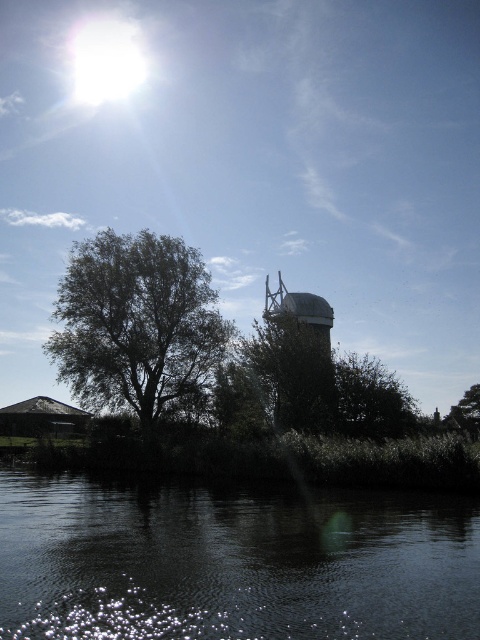
You are standing at the point with coordinates point (213, 298) and want to walk towards the point with coordinates point (457, 426). Based on the scene, will you pass through any obstacles along the way?

Since point (213, 298) is in front of point (457, 426), you will not pass through any obstacles because the path between them is clear.

You are a photographer trying to capture the windmill and its surroundings. You notice the dark reflective water at lower center and the green leafy tree at left in your viewfinder. Which object appears shorter in your photo?

The dark reflective water at lower center appears shorter than the green leafy tree at left because it is not as tall.

You are standing in the rural scene and want to walk from the green leafy tree at left to the green leafy tree at lower right. Which direction should you head?

The green leafy tree at left is positioned on the left side of green leafy tree at lower right, so you should head to the right to reach the green leafy tree at lower right from the green leafy tree at left.